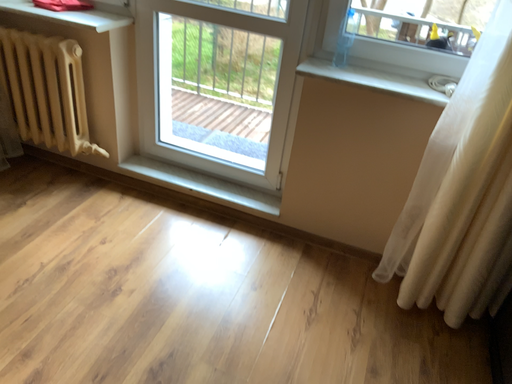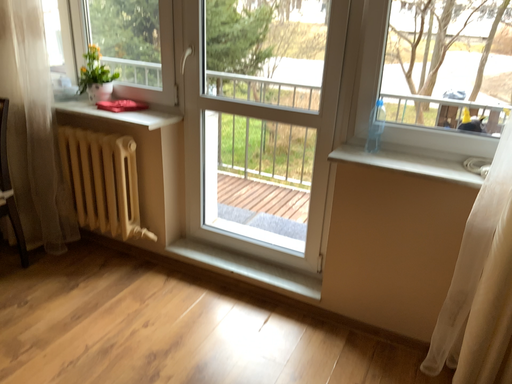
Question: How did the camera likely rotate when shooting the video?

Choices:
 (A) rotated upward
 (B) rotated downward

Answer: (A)